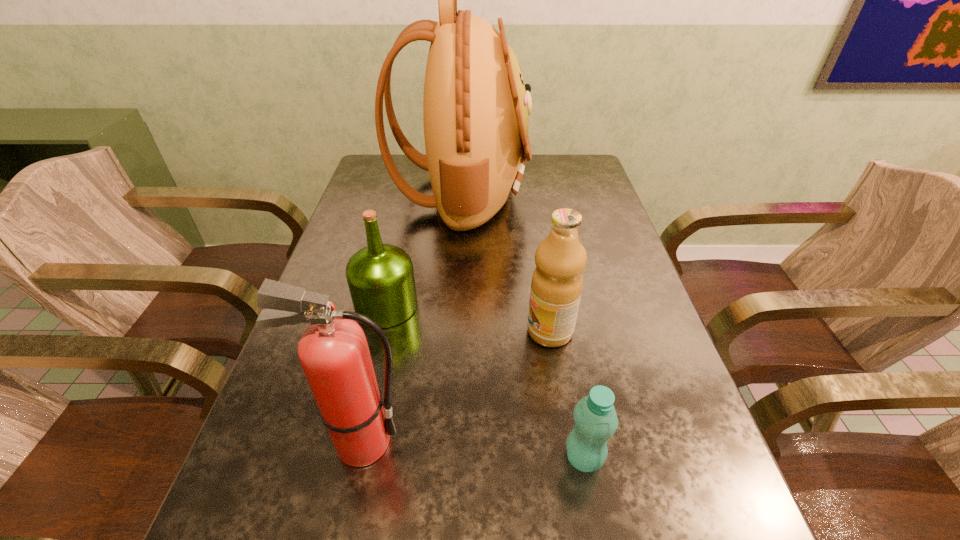
Locate an element on the screen. This screenshot has width=960, height=540. free space located 0.300m on the label of the third tallest object is located at coordinates (389, 331).

Find the location of a particular element. Image resolution: width=960 pixels, height=540 pixels. free point located on the label of the third tallest object is located at coordinates (397, 331).

Find the location of `vacant area located 0.090m on the label of the third tallest object`. vacant area located 0.090m on the label of the third tallest object is located at coordinates (485, 331).

The height and width of the screenshot is (540, 960). Find the location of `vacant space situated 0.300m on the right of the left olive oil`. vacant space situated 0.300m on the right of the left olive oil is located at coordinates (548, 306).

Locate an element on the screen. Image resolution: width=960 pixels, height=540 pixels. vacant space located 0.380m on the left of the bottle is located at coordinates (339, 458).

The height and width of the screenshot is (540, 960). Find the location of `object that is at the far edge`. object that is at the far edge is located at coordinates (475, 108).

Locate an element on the screen. The image size is (960, 540). backpack that is at the left edge is located at coordinates (475, 108).

The width and height of the screenshot is (960, 540). Identify the location of fire extinguisher at the left edge. (333, 351).

Locate an element on the screen. This screenshot has width=960, height=540. olive oil located in the left edge section of the desktop is located at coordinates (380, 277).

The height and width of the screenshot is (540, 960). In order to click on object that is at the far left corner in this screenshot , I will do `click(475, 108)`.